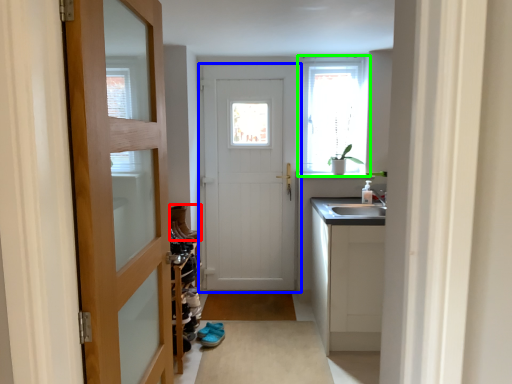
Question: Which object is the farthest from shoe (highlighted by a red box)? Choose among these: door (highlighted by a blue box) or window (highlighted by a green box).

Choices:
 (A) door
 (B) window

Answer: (B)